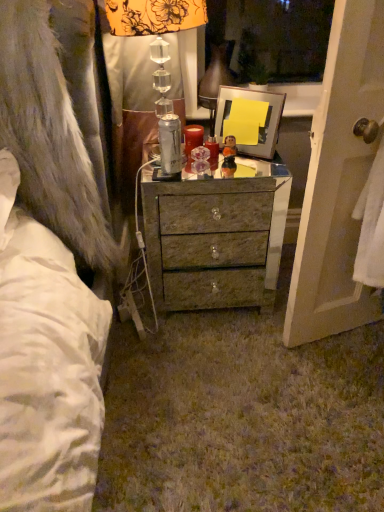
Question: From their relative heights in the image, would you say silver metallic can at center is taller or shorter than metallic glass lampshade at upper center?

Choices:
 (A) tall
 (B) short

Answer: (B)

Question: Visually, is silver metallic can at center positioned to the left or to the right of metallic glass lampshade at upper center?

Choices:
 (A) left
 (B) right

Answer: (B)

Question: Which is nearer to the matte red candle at center?

Choices:
 (A) translucent glass figurine at center
 (B) white towel at right
 (C) fuzzy gray fur coat at left
 (D) metallic silver picture frame at center
 (E) shiny metallic drawer at center

Answer: (A)

Question: Based on their relative distances, which object is nearer to the metallic silver picture frame at center?

Choices:
 (A) shiny metallic drawer at center
 (B) matte red candle at center
 (C) metallic glass lampshade at upper center
 (D) translucent glass figurine at center
 (E) silver metallic can at center

Answer: (B)